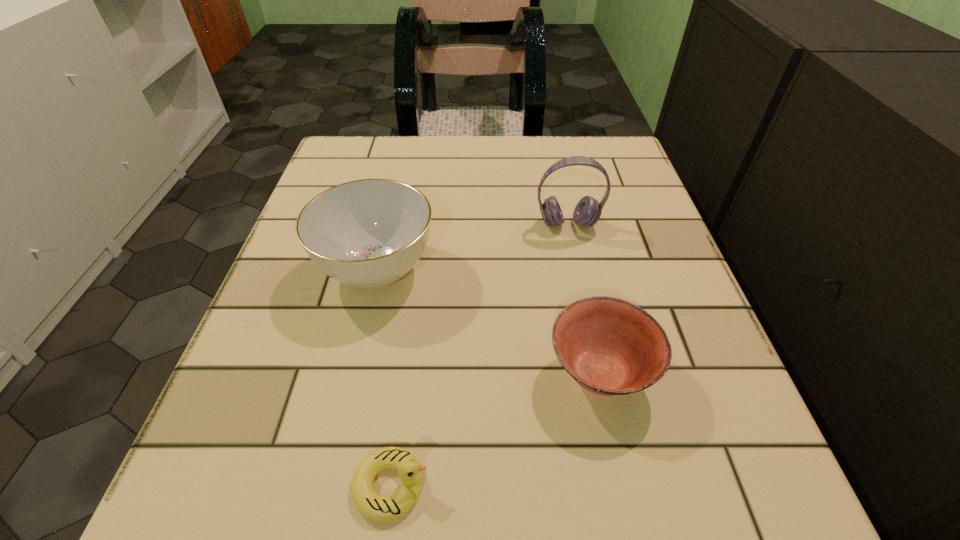
Identify the location of headset. This screenshot has width=960, height=540. (587, 212).

Identify the location of chinaware. The image size is (960, 540). (369, 233).

Find the location of `the second nearest object`. the second nearest object is located at coordinates (610, 346).

At what (x,y) coordinates should I click in order to perform the action: click on the third tallest object. Please return your answer as a coordinate pair (x, y). The height and width of the screenshot is (540, 960). Looking at the image, I should click on (610, 346).

Locate an element on the screen. The height and width of the screenshot is (540, 960). duckling is located at coordinates (367, 501).

You are a GUI agent. You are given a task and a screenshot of the screen. Output one action in this format:
    pyautogui.click(x=<x>, y=<y>)
    Task: Click on the shortest object
    The width and height of the screenshot is (960, 540).
    Given the screenshot: What is the action you would take?
    pyautogui.click(x=367, y=501)

This screenshot has width=960, height=540. Identify the location of vacant area located 0.240m on the headband and ear cups of the tallest object. (592, 338).

Locate an element on the screen. This screenshot has height=540, width=960. vacant space positioned 0.150m on the right of the chinaware is located at coordinates click(x=523, y=268).

This screenshot has height=540, width=960. Identify the location of vacant area located on the left of the third farthest object. (503, 374).

Locate an element on the screen. The width and height of the screenshot is (960, 540). free region located 0.330m on the face of the shortest object is located at coordinates (712, 485).